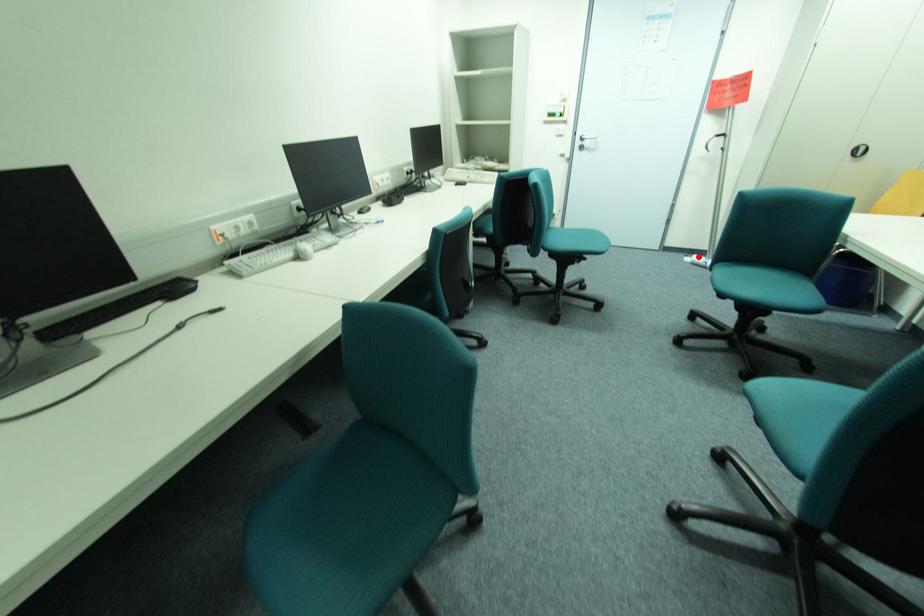
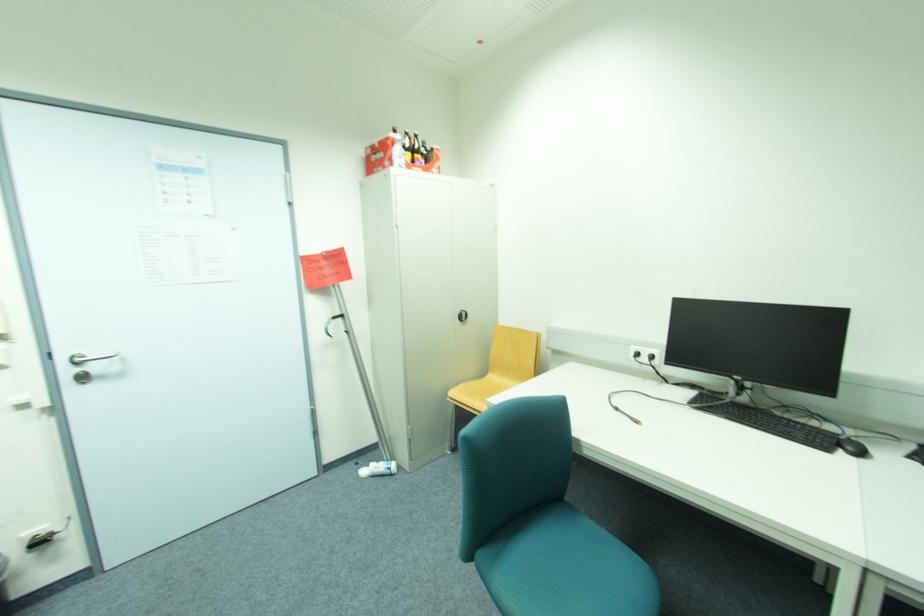
Question: I am providing you with two images of the same scene from different viewpoints. In image1, a red point is highlighted. Considering the same 3D point in image2, which of the following is correct?

Choices:
 (A) It is closer
 (B) It is farther

Answer: (A)